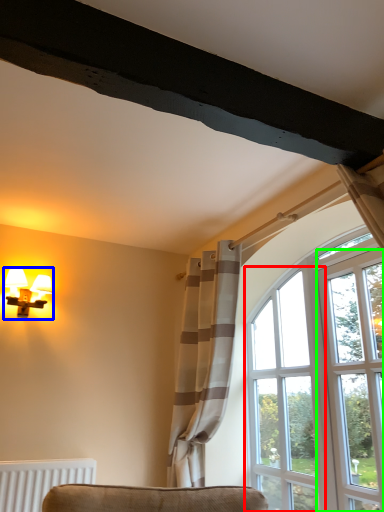
Question: Based on their relative distances, which object is farther from window (highlighted by a red box)? Choose from lamp (highlighted by a blue box) and screen door (highlighted by a green box).

Choices:
 (A) lamp
 (B) screen door

Answer: (A)